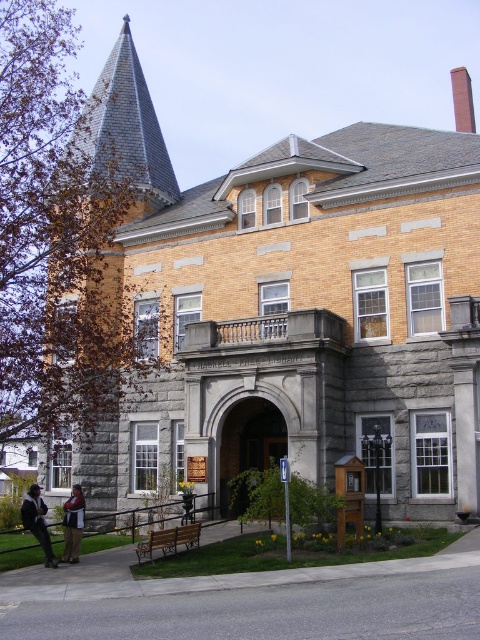
Does dark brown leather jacket at lower left have a smaller size compared to denim jacket at lower left?

Incorrect, dark brown leather jacket at lower left is not smaller in size than denim jacket at lower left.

Describe the element at coordinates (37, 522) in the screenshot. This screenshot has height=640, width=480. I see `dark brown leather jacket at lower left` at that location.

Where is `dark brown leather jacket at lower left`? This screenshot has width=480, height=640. dark brown leather jacket at lower left is located at coordinates (37, 522).

Does orange brick spire at upper left appear on the right side of denim jacket at lower left?

Indeed, orange brick spire at upper left is positioned on the right side of denim jacket at lower left.

Does point (46, 364) come farther from viewer compared to point (78, 545)?

Yes.

Where is `orange brick spire at upper left`? The height and width of the screenshot is (640, 480). orange brick spire at upper left is located at coordinates (105, 266).

Between gray slate spire at upper left and denim jacket at lower left, which one is positioned higher?

gray slate spire at upper left is above.

What do you see at coordinates (128, 124) in the screenshot? Image resolution: width=480 pixels, height=640 pixels. I see `gray slate spire at upper left` at bounding box center [128, 124].

Locate an element on the screen. This screenshot has height=640, width=480. gray slate spire at upper left is located at coordinates (128, 124).